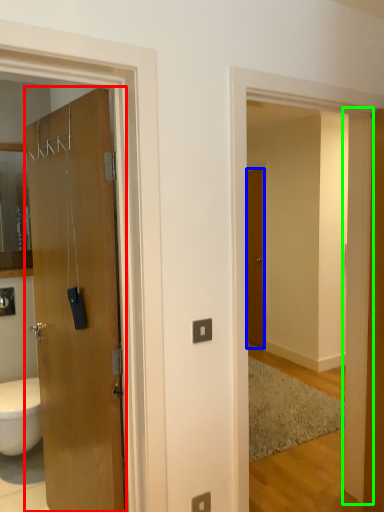
Question: Considering the real-world distances, which object is closest to door (highlighted by a red box)? door (highlighted by a blue box) or pillar (highlighted by a green box).

Choices:
 (A) door
 (B) pillar

Answer: (B)